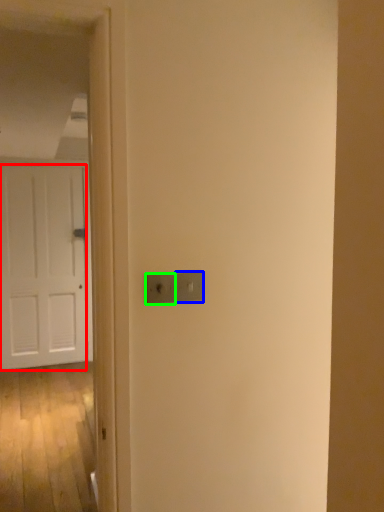
Question: Which object is the farthest from door (highlighted by a red box)? Choose among these: light switch (highlighted by a blue box) or light switch (highlighted by a green box).

Choices:
 (A) light switch
 (B) light switch

Answer: (A)